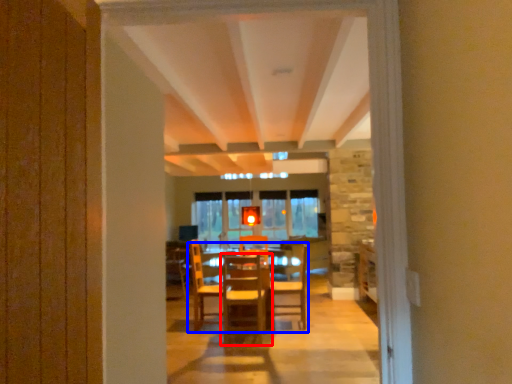
Question: Among these objects, which one is farthest to the camera, chair (highlighted by a red box) or table (highlighted by a blue box)?

Choices:
 (A) chair
 (B) table

Answer: (B)